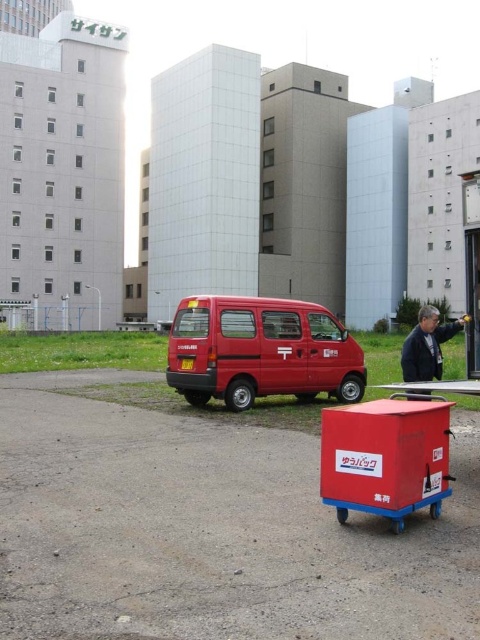
You are standing at the point with coordinates (385, 458) in the image. What object are you standing on?

You are standing on the red plastic cart at center.

Where is the matte red van at center located in the image?

The matte red van at center is located at point (261,352) in the image.